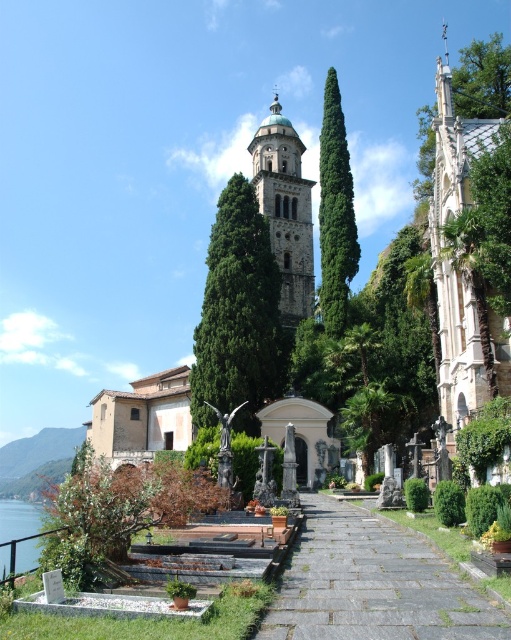
Question: Can you confirm if gray stone path at center is positioned below polished stone church at right?

Choices:
 (A) no
 (B) yes

Answer: (B)

Question: Is polished stone church at right wider than green leafy bush at lower left?

Choices:
 (A) no
 (B) yes

Answer: (A)

Question: Which is farther from the green leafy bush at lower left?

Choices:
 (A) green leafy tree at center
 (B) gray stone path at center

Answer: (A)

Question: Which object is positioned closest to the gray stone path at center?

Choices:
 (A) stone tower at center
 (B) clear water at lower left
 (C) polished stone church at right
 (D) green textured tree at center

Answer: (C)

Question: Is green leafy tree at center thinner than green leafy tree at right?

Choices:
 (A) no
 (B) yes

Answer: (B)

Question: Estimate the real-world distances between objects in this image. Which object is farther from the green leafy tree at right?

Choices:
 (A) gray stone path at center
 (B) green textured tree at center
 (C) clear water at lower left

Answer: (C)